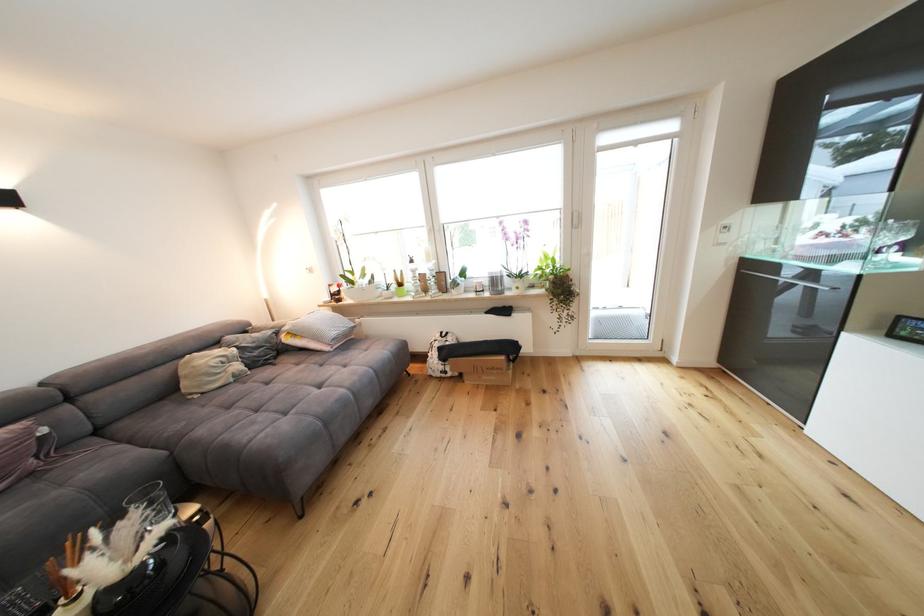
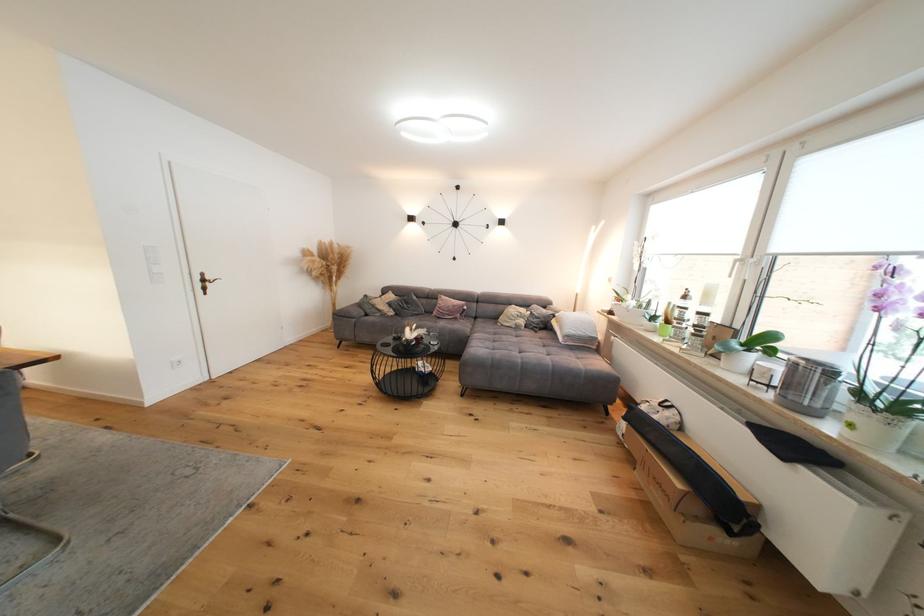
Locate, in the second image, the point that corresponds to the point at 517,317 in the first image.

(793, 461)